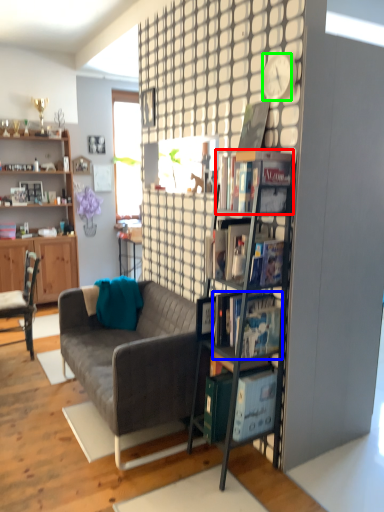
Question: Which is farther away from book (highlighted by a red box)? book (highlighted by a blue box) or clock (highlighted by a green box)?

Choices:
 (A) book
 (B) clock

Answer: (A)